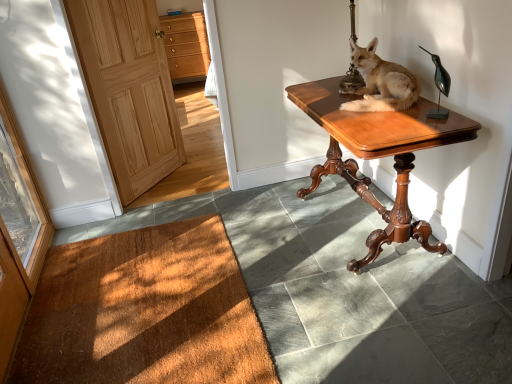
Question: Is bronze metallic bird at upper right inside or outside of mahogany wood desk at center?

Choices:
 (A) outside
 (B) inside

Answer: (A)

Question: In terms of size, does bronze metallic bird at upper right appear bigger or smaller than mahogany wood desk at center?

Choices:
 (A) small
 (B) big

Answer: (A)

Question: Which is farther from the transparent glass door at left?

Choices:
 (A) bronze metallic bird at upper right
 (B) mahogany wood desk at center
 (C) brown textured mat at lower left
 (D) light brown wood drawers at upper left
 (E) light brown fur at center

Answer: (D)

Question: Based on their relative distances, which object is farther from the light brown wood door at left?

Choices:
 (A) light brown fur at center
 (B) brown textured mat at lower left
 (C) mahogany wood desk at center
 (D) transparent glass door at left
 (E) light brown wood drawers at upper left

Answer: (E)